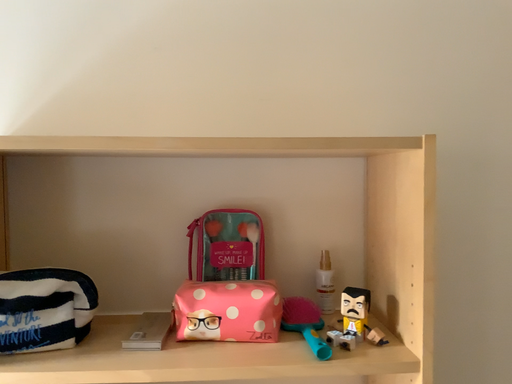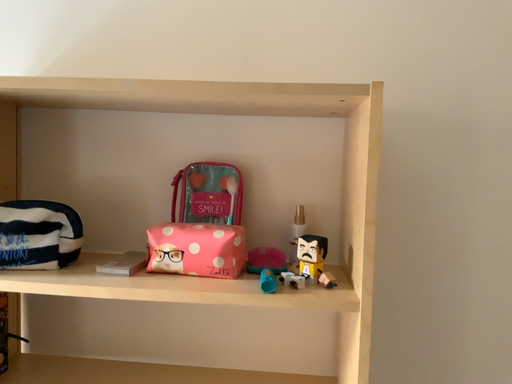
Question: Which way did the camera rotate in the video?

Choices:
 (A) rotated left
 (B) rotated right

Answer: (A)